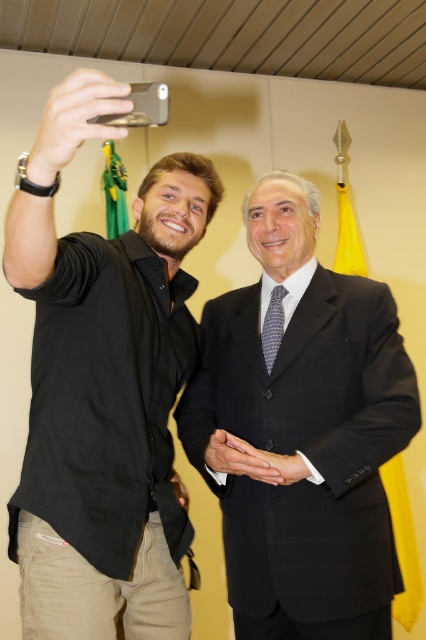
You are standing in the room and want to place a small sticker on the closer of the two points, point(166, 468) and point(227, 296). Which point should you choose?

Point(166, 468) is closer to the camera than point(227, 296), so you should choose point(166, 468).